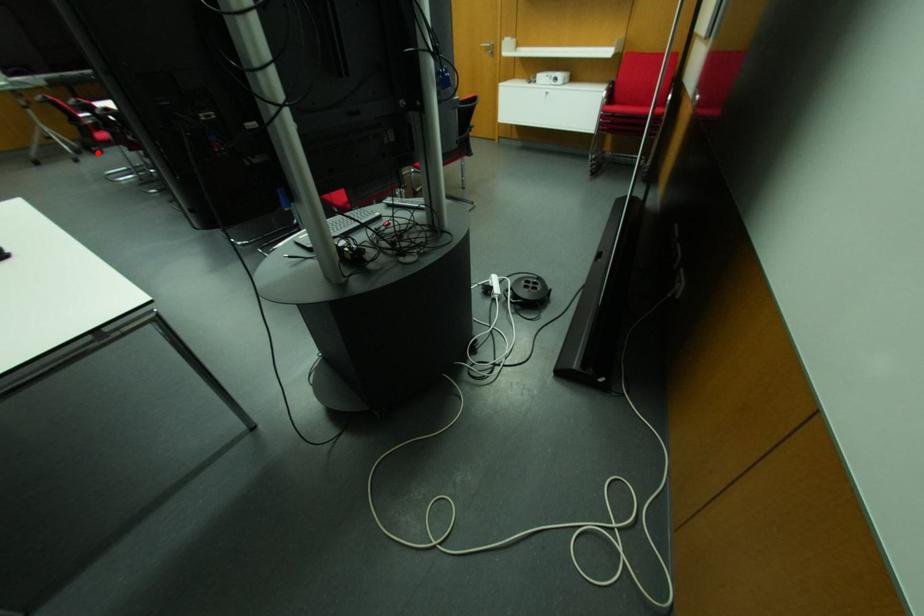
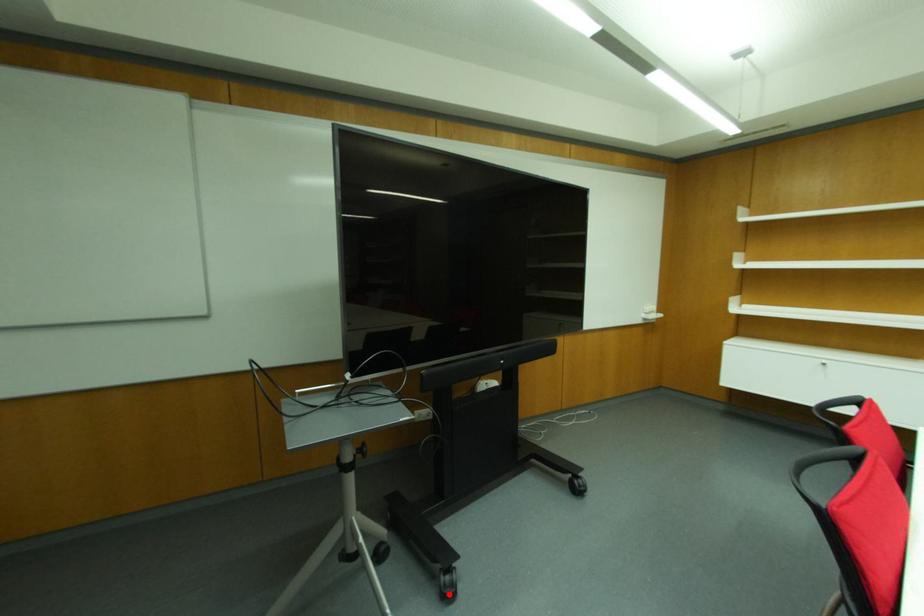
In the scene shown: I am providing you with two images of the same scene from different viewpoints. A red point is marked on the first image and another point is marked on the second image. Is the red point in image1 aligned with the point shown in image2?

Yes